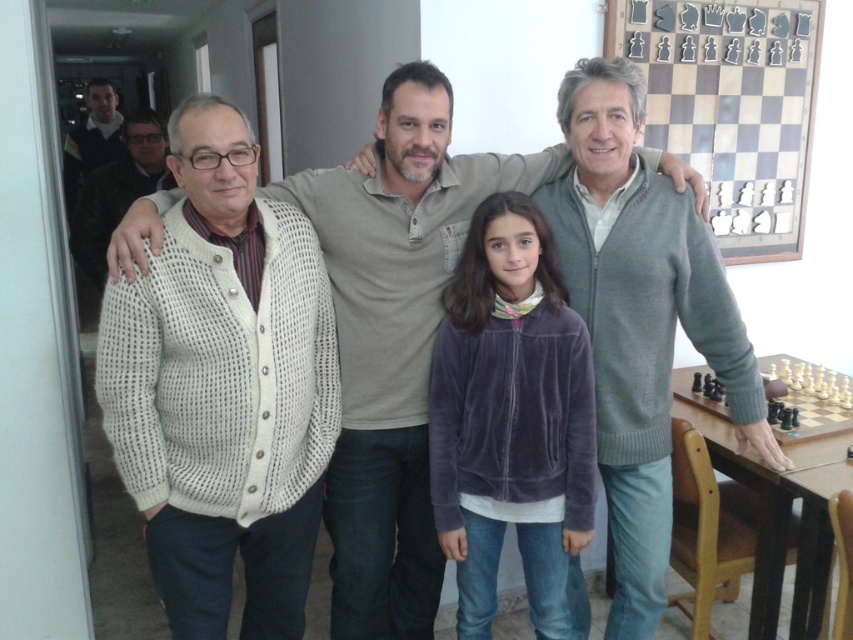
Question: Among these objects, which one is nearest to the camera?

Choices:
 (A) white knitted sweater at left
 (B) gray knit sweater at right

Answer: (B)

Question: Is white knitted cardigan at left below gray knit sweater at right?

Choices:
 (A) yes
 (B) no

Answer: (A)

Question: Considering the relative positions of white knitted cardigan at left and white knitted sweater at left in the image provided, where is white knitted cardigan at left located with respect to white knitted sweater at left?

Choices:
 (A) left
 (B) right

Answer: (B)

Question: Which point is closer to the camera taking this photo?

Choices:
 (A) (637, 408)
 (B) (421, 627)
 (C) (119, 172)

Answer: (A)

Question: Is white knitted cardigan at left smaller than gray knit sweater at right?

Choices:
 (A) yes
 (B) no

Answer: (B)

Question: Which point is closer to the camera?

Choices:
 (A) gray knit sweater at right
 (B) white knitted cardigan at left
 (C) white knitted sweater at left

Answer: (B)